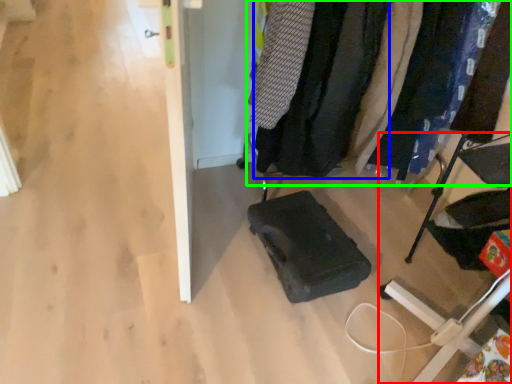
Question: Estimate the real-world distances between objects in this image. Which object is farther from furniture (highlighted by a red box), clothing (highlighted by a blue box) or closet (highlighted by a green box)?

Choices:
 (A) clothing
 (B) closet

Answer: (A)